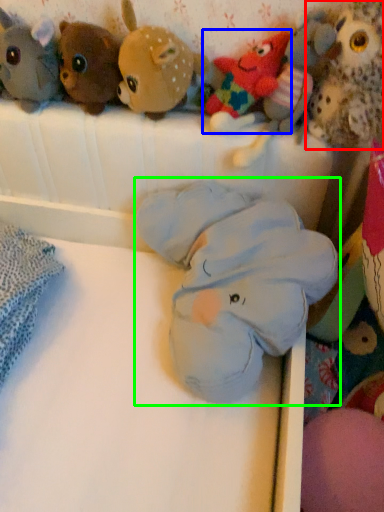
Question: Based on their relative distances, which object is farther from toy (highlighted by a red box)? Choose from toy (highlighted by a blue box) and toy (highlighted by a green box).

Choices:
 (A) toy
 (B) toy

Answer: (B)